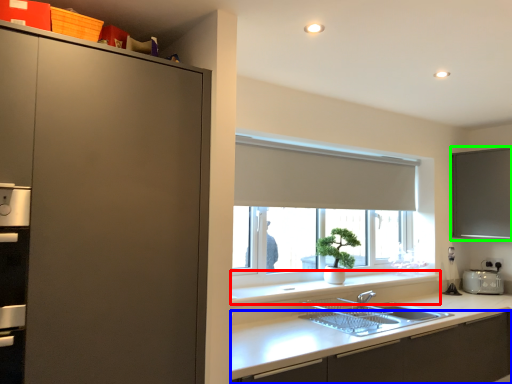
Question: Estimate the real-world distances between objects in this image. Which object is farther from window sill (highlighted by a red box), cabinetry (highlighted by a blue box) or window screen (highlighted by a green box)?

Choices:
 (A) cabinetry
 (B) window screen

Answer: (B)